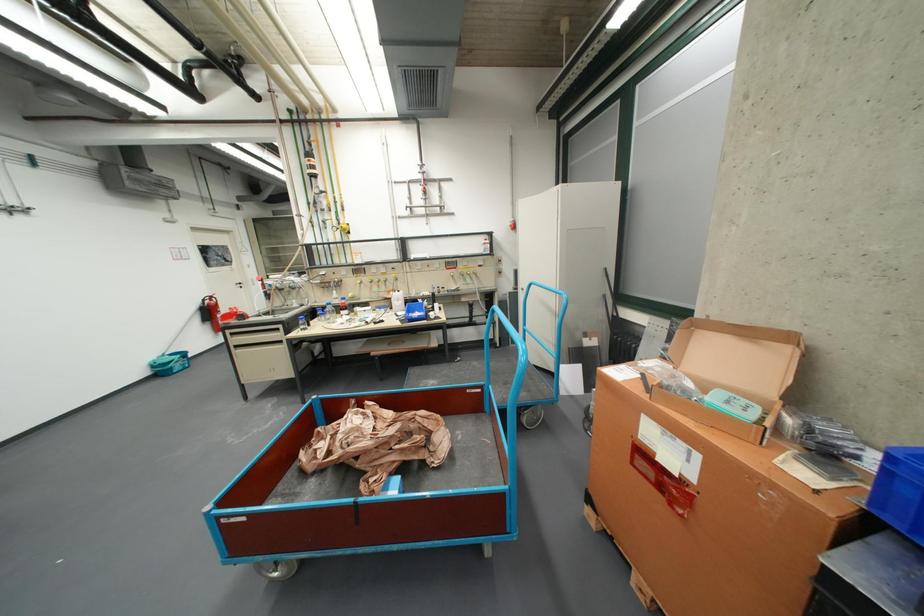
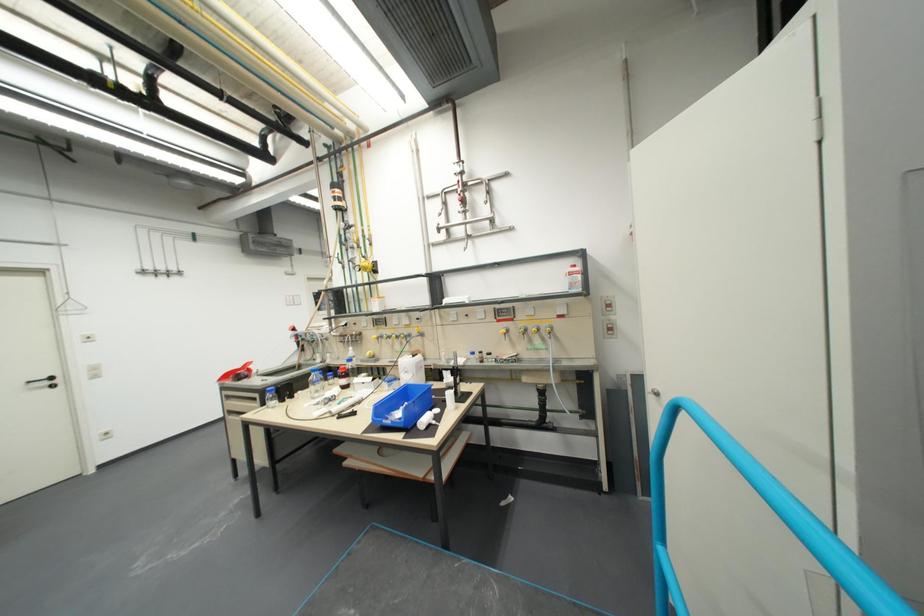
In the second image, find the point that corresponds to point (426, 296) in the first image.

(455, 363)